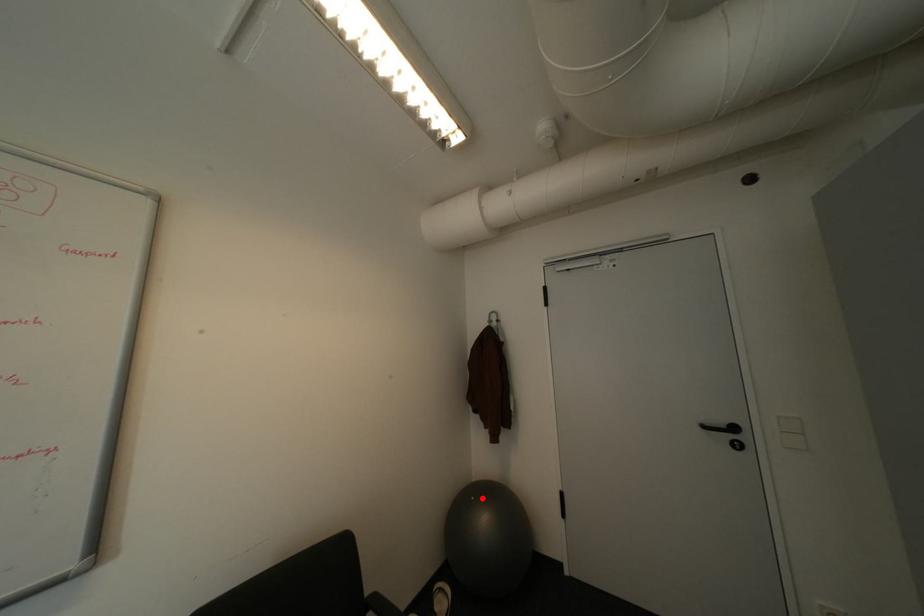
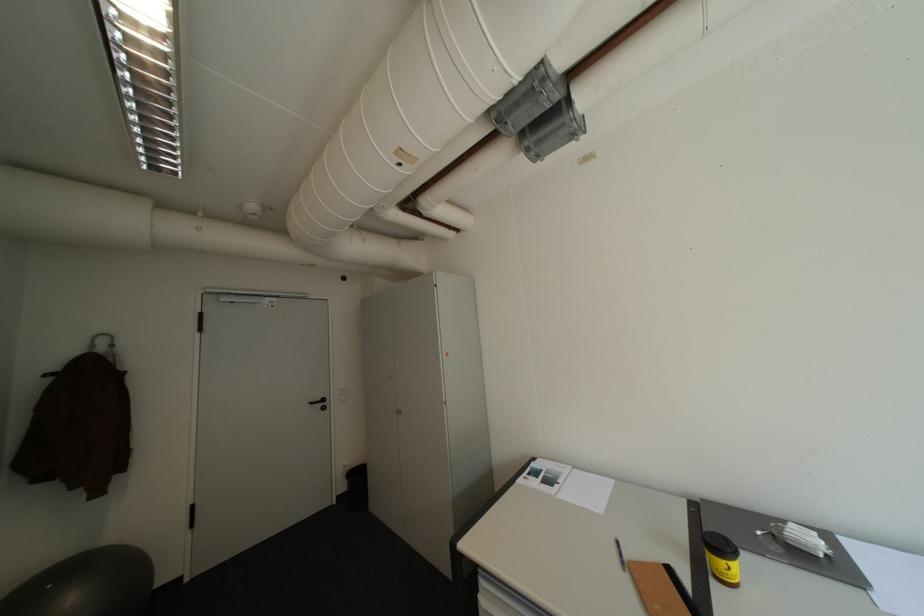
Question: I am providing you with two images of the same scene from different viewpoints. A red point is shown in image1. For the corresponding object point in image2, is it positioned nearer or farther from the camera?

Choices:
 (A) Nearer
 (B) Farther

Answer: (B)